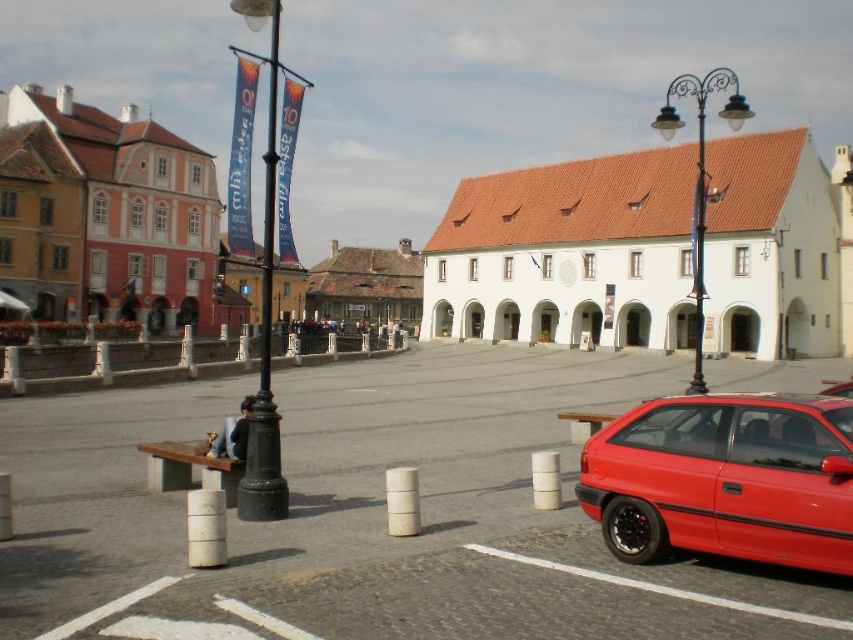
Can you confirm if white concrete parking lot at center is positioned above white matte building at center?

Actually, white concrete parking lot at center is below white matte building at center.

The height and width of the screenshot is (640, 853). What do you see at coordinates (450, 467) in the screenshot? I see `white concrete parking lot at center` at bounding box center [450, 467].

Between point (517, 424) and point (515, 292), which one is positioned in front?

Positioned in front is point (517, 424).

The image size is (853, 640). Identify the location of white concrete parking lot at center. (450, 467).

Can you confirm if white matte building at center is positioned above black metal pole at left?

No, white matte building at center is not above black metal pole at left.

Who is more distant from viewer, (462, 291) or (285, 506)?

The point (462, 291) is behind.

This screenshot has width=853, height=640. I want to click on white matte building at center, so click(564, 253).

Does white concrete parking lot at center have a lesser height compared to black wrought iron streetlight at upper right?

Indeed, white concrete parking lot at center has a lesser height compared to black wrought iron streetlight at upper right.

Can you confirm if white concrete parking lot at center is positioned to the right of black wrought iron streetlight at upper right?

No, white concrete parking lot at center is not to the right of black wrought iron streetlight at upper right.

Find the location of `white concrete parking lot at center`. white concrete parking lot at center is located at coordinates (450, 467).